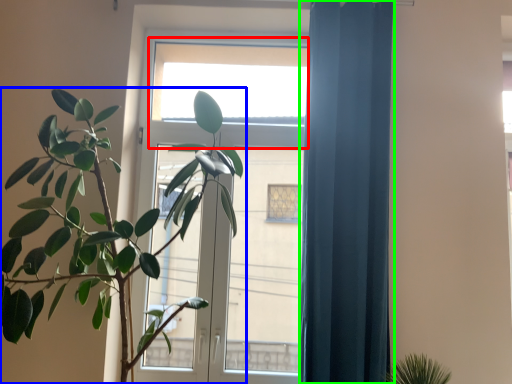
Question: Which is nearer to the window (highlighted by a red box)? houseplant (highlighted by a blue box) or curtain (highlighted by a green box).

Choices:
 (A) houseplant
 (B) curtain

Answer: (B)